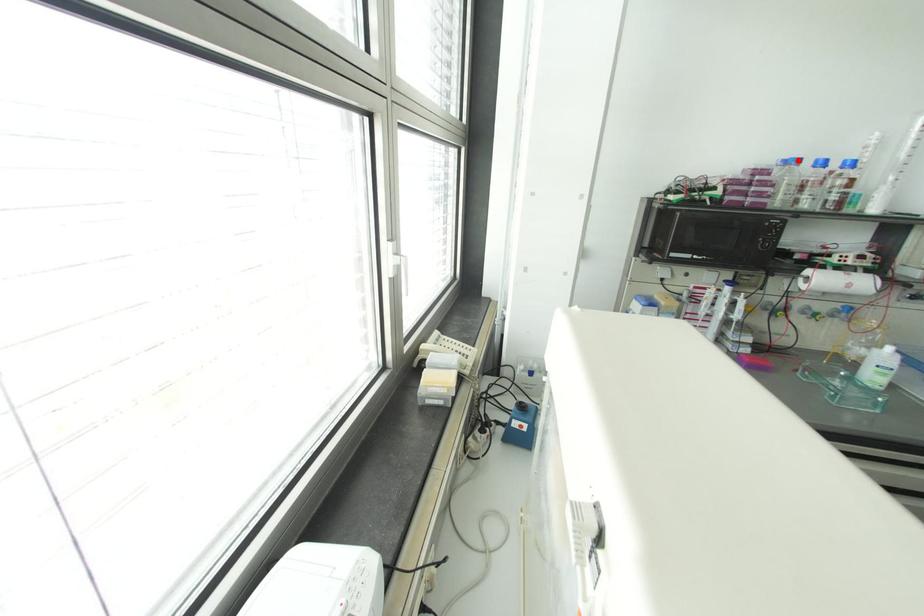
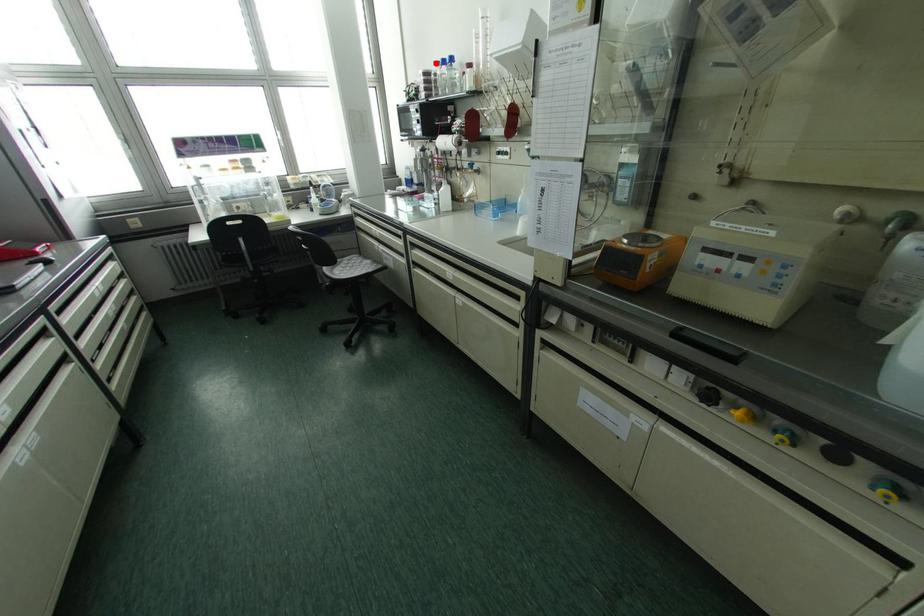
I am providing you with two images of the same scene from different viewpoints. A red point is marked on the first image and another point is marked on the second image. Is the marked point in image1 the same physical position as the marked point in image2?

Yes